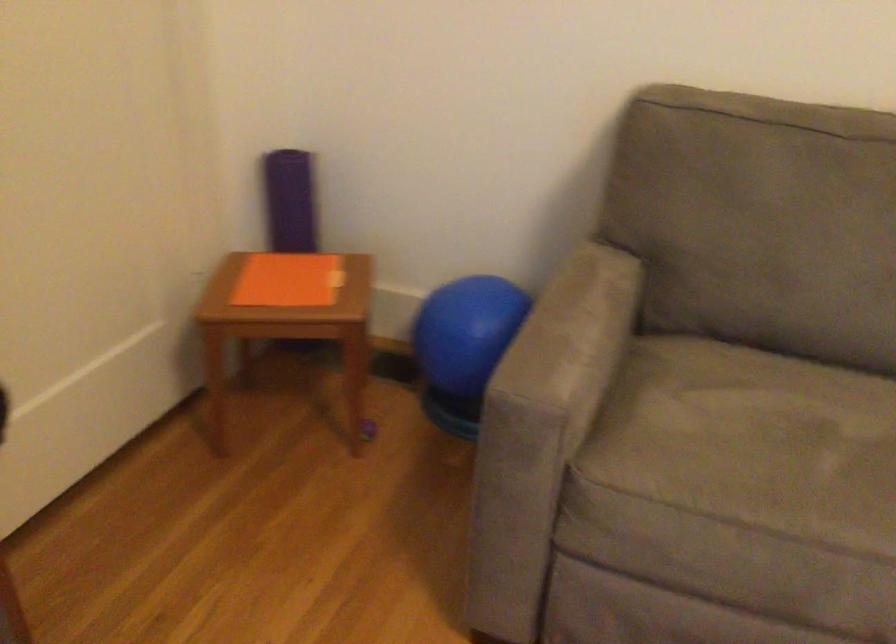
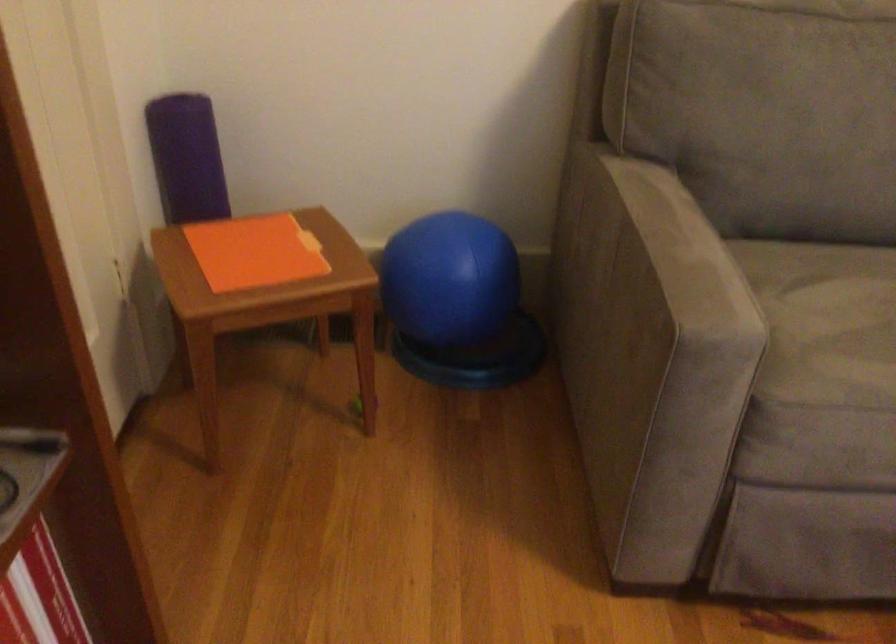
Question: The first image is from the beginning of the video and the second image is from the end. How did the camera likely rotate when shooting the video?

Choices:
 (A) Left
 (B) Right
 (C) Up
 (D) Down

Answer: (B)